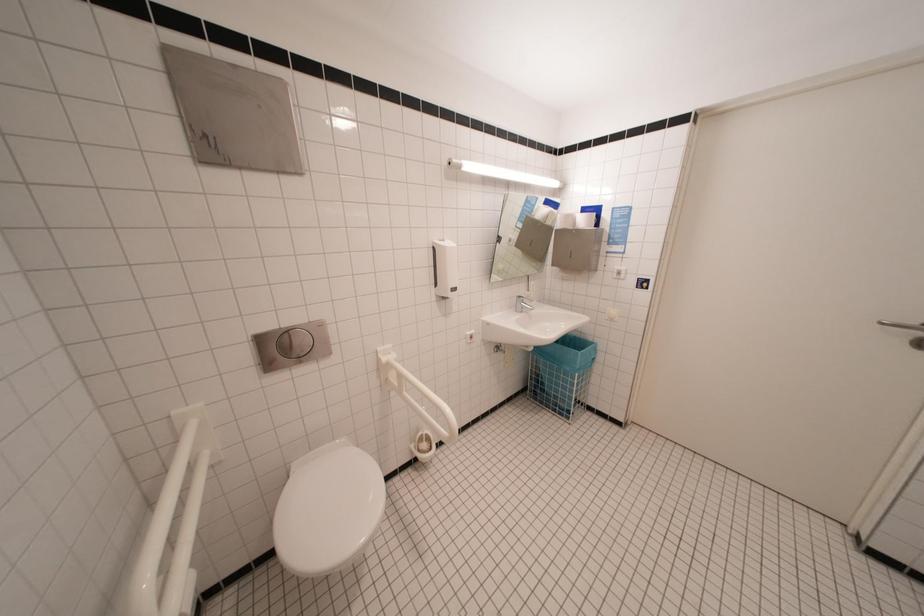
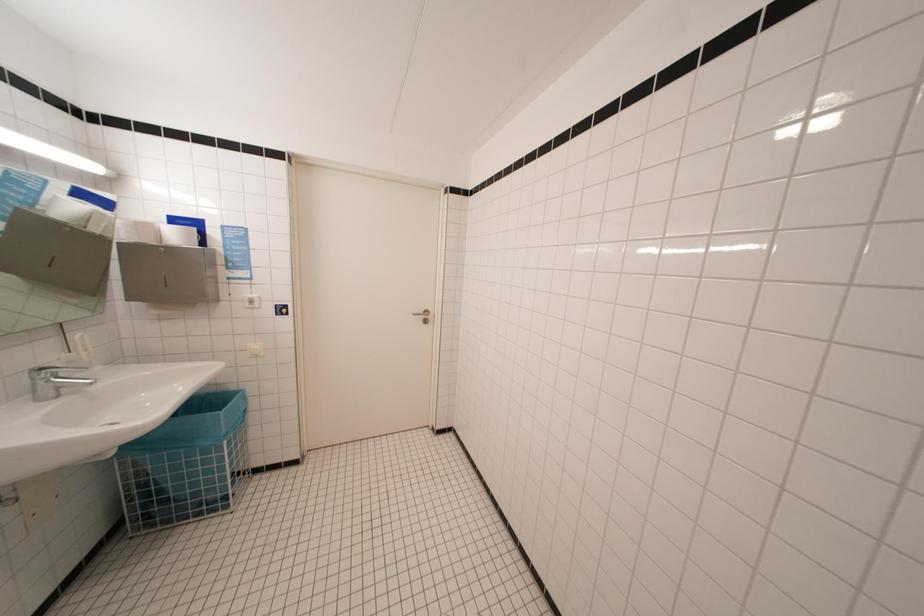
Question: The images are taken continuously from a first-person perspective. In which direction is your viewpoint rotating?

Choices:
 (A) Left
 (B) Right
 (C) Up
 (D) Down

Answer: (B)